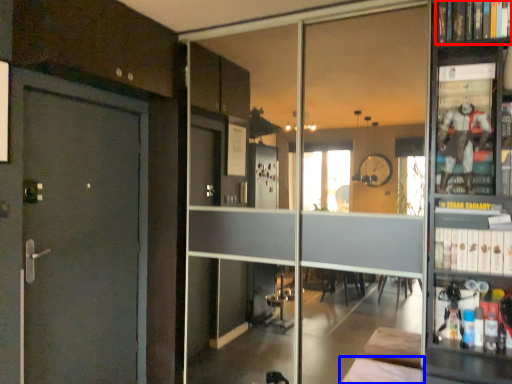
Question: Which object appears closest to the camera in this image, book (highlighted by a red box) or furniture (highlighted by a blue box)?

Choices:
 (A) book
 (B) furniture

Answer: (B)